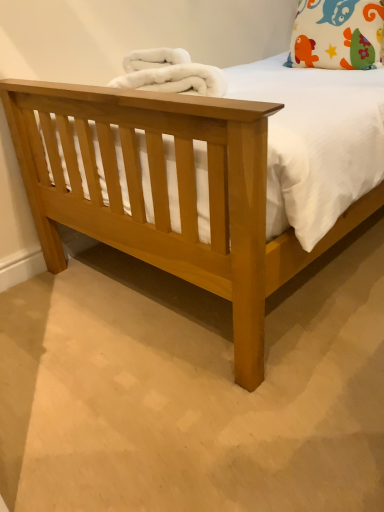
Question: Considering their positions, is white fluffy blanket at upper center located in front of or behind white fabric pillow with colorful patterns at upper right?

Choices:
 (A) front
 (B) behind

Answer: (A)

Question: Visually, is white fluffy blanket at upper center positioned to the left or to the right of white fabric pillow with colorful patterns at upper right?

Choices:
 (A) left
 (B) right

Answer: (A)

Question: From a real-world perspective, relative to white fabric pillow with colorful patterns at upper right, is white fluffy blanket at upper center vertically above or below?

Choices:
 (A) below
 (B) above

Answer: (A)

Question: From a real-world perspective, relative to white fluffy blanket at upper center, is white fabric pillow with colorful patterns at upper right vertically above or below?

Choices:
 (A) above
 (B) below

Answer: (A)

Question: Would you say white fabric pillow with colorful patterns at upper right is to the left or to the right of white fluffy blanket at upper center in the picture?

Choices:
 (A) left
 (B) right

Answer: (B)

Question: From the image's perspective, is white fabric pillow with colorful patterns at upper right above or below white fluffy blanket at upper center?

Choices:
 (A) above
 (B) below

Answer: (A)

Question: From their relative heights in the image, would you say white fabric pillow with colorful patterns at upper right is taller or shorter than white fluffy blanket at upper center?

Choices:
 (A) tall
 (B) short

Answer: (A)